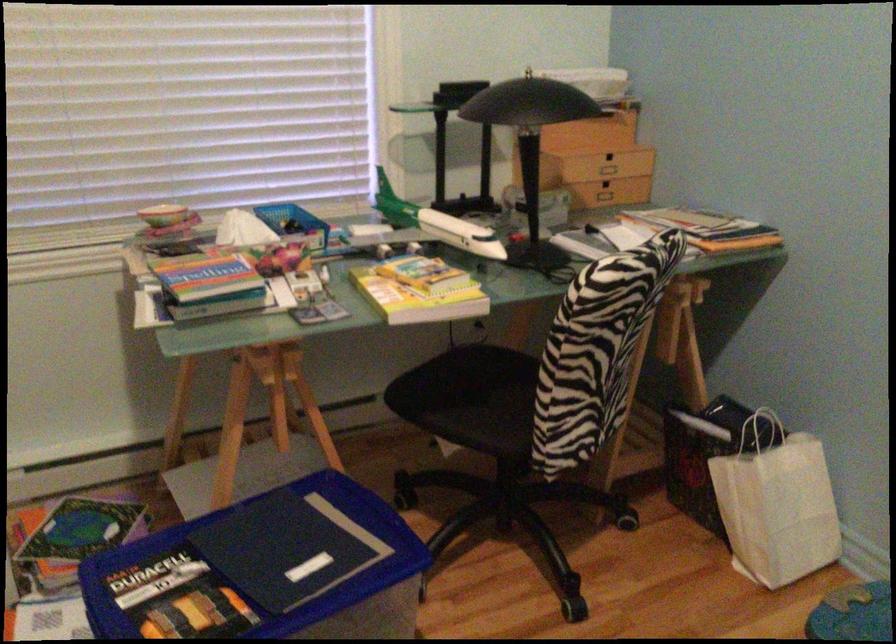
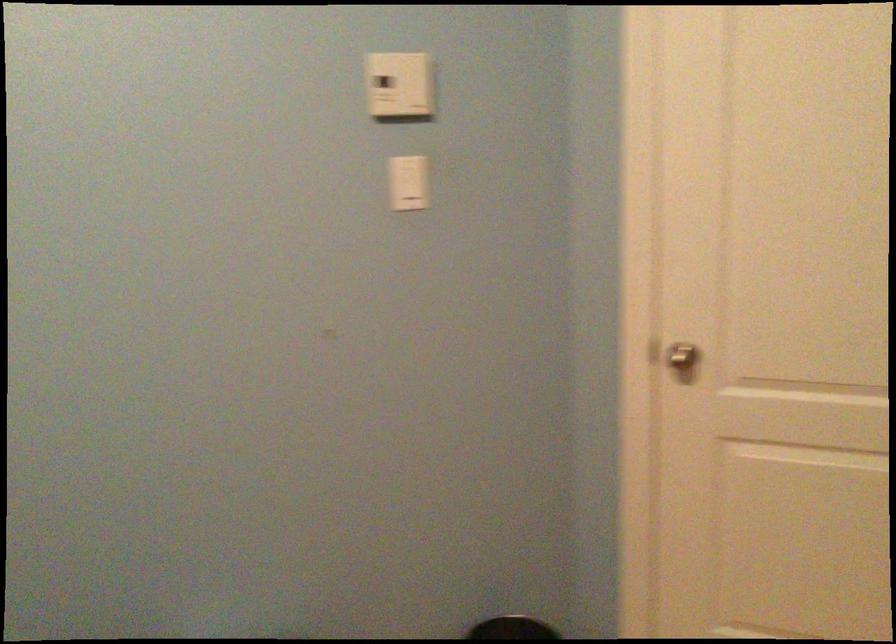
Question: The camera is either moving clockwise (left) or counter-clockwise (right) around the object. The first image is from the beginning of the video and the second image is from the end. Is the camera moving left or right when shooting the video?

Choices:
 (A) Left
 (B) Right

Answer: (A)